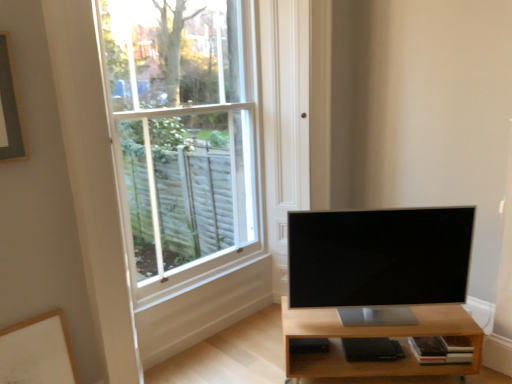
Measure the distance between point (337, 240) and camera.

Point (337, 240) is 7.23 feet away from camera.

The width and height of the screenshot is (512, 384). I want to click on white matte picture frame at lower left, so pyautogui.click(x=37, y=351).

The width and height of the screenshot is (512, 384). Describe the element at coordinates (37, 351) in the screenshot. I see `white matte picture frame at lower left` at that location.

At what (x,y) coordinates should I click in order to perform the action: click on light brown wood shelf at lower right. Please return your answer as a coordinate pair (x, y). Looking at the image, I should click on (375, 336).

Is white glass window at upper left located outside light brown wood shelf at lower right?

Yes, white glass window at upper left is not within light brown wood shelf at lower right.

Between white glass window at upper left and light brown wood shelf at lower right, which one has less height?

With less height is light brown wood shelf at lower right.

Which point is more forward, (189, 48) or (336, 341)?

The point (336, 341) is more forward.

Are light brown wood shelf at lower right and satin black tv at center far apart?

light brown wood shelf at lower right is near satin black tv at center, not far away.

From a real-world perspective, between light brown wood shelf at lower right and satin black tv at center, who is vertically higher?

satin black tv at center.

Can you confirm if light brown wood shelf at lower right is shorter than satin black tv at center?

Yes.

Does light brown wood shelf at lower right have a greater width compared to satin black tv at center?

Indeed, light brown wood shelf at lower right has a greater width compared to satin black tv at center.

Does satin black tv at center have a greater height compared to white glass window at upper left?

No, satin black tv at center is not taller than white glass window at upper left.

Does satin black tv at center turn towards white glass window at upper left?

No, satin black tv at center is not oriented towards white glass window at upper left.

From a real-world perspective, is satin black tv at center above or below white glass window at upper left?

satin black tv at center is below white glass window at upper left.

Identify the location of window located above the satin black tv at center (from the image's perspective). (184, 138).

Is there a large distance between white matte picture frame at lower left and white glass window at upper left?

white matte picture frame at lower left is near white glass window at upper left, not far away.

Which is more distant, (20, 378) or (126, 11)?

Positioned behind is point (126, 11).

Image resolution: width=512 pixels, height=384 pixels. What are the coordinates of `window above the white matte picture frame at lower left (from a real-world perspective)` in the screenshot? It's located at (184, 138).

Are white matte picture frame at lower left and light brown wood shelf at lower right beside each other?

No, white matte picture frame at lower left is not in contact with light brown wood shelf at lower right.

From a real-world perspective, is white matte picture frame at lower left below light brown wood shelf at lower right?

No, from a real-world perspective, white matte picture frame at lower left is not beneath light brown wood shelf at lower right.

In terms of width, does white matte picture frame at lower left look wider or thinner when compared to light brown wood shelf at lower right?

Considering their sizes, white matte picture frame at lower left looks slimmer than light brown wood shelf at lower right.

Is white matte picture frame at lower left shorter than light brown wood shelf at lower right?

No.

Is satin black tv at center aimed at light brown wood shelf at lower right?

No, satin black tv at center does not turn towards light brown wood shelf at lower right.

Who is smaller, satin black tv at center or light brown wood shelf at lower right?

satin black tv at center.

From a real-world perspective, is satin black tv at center above or below light brown wood shelf at lower right?

From a real-world perspective, satin black tv at center is physically above light brown wood shelf at lower right.

Is satin black tv at center not within light brown wood shelf at lower right?

Yes, satin black tv at center is outside of light brown wood shelf at lower right.

Which is in front, white matte picture frame at lower left or satin black tv at center?

white matte picture frame at lower left.

Can you confirm if white matte picture frame at lower left is positioned to the right of satin black tv at center?

No.

Based on the photo, would you say white matte picture frame at lower left is inside or outside satin black tv at center?

white matte picture frame at lower left is located beyond the bounds of satin black tv at center.

Identify the location of window above the light brown wood shelf at lower right (from the image's perspective). This screenshot has height=384, width=512. (184, 138).

Where is `shelf that is below the satin black tv at center (from the image's perspective)`? The image size is (512, 384). shelf that is below the satin black tv at center (from the image's perspective) is located at coordinates (375, 336).

Looking at the image, which one is located closer to white glass window at upper left, satin black tv at center or light brown wood shelf at lower right?

Based on the image, satin black tv at center appears to be nearer to white glass window at upper left.

Based on their spatial positions, is light brown wood shelf at lower right or satin black tv at center closer to white matte picture frame at lower left?

Based on the image, light brown wood shelf at lower right appears to be nearer to white matte picture frame at lower left.

Looking at this image, based on their spatial positions, is white matte picture frame at lower left or light brown wood shelf at lower right further from satin black tv at center?

The object further to satin black tv at center is white matte picture frame at lower left.

Looking at the image, which one is located further to white matte picture frame at lower left, white glass window at upper left or light brown wood shelf at lower right?

The object further to white matte picture frame at lower left is light brown wood shelf at lower right.

Estimate the real-world distances between objects in this image. Which object is further from white matte picture frame at lower left, light brown wood shelf at lower right or white glass window at upper left?

light brown wood shelf at lower right lies further to white matte picture frame at lower left than the other object.

Looking at the image, which one is located further to satin black tv at center, white glass window at upper left or white matte picture frame at lower left?

white matte picture frame at lower left.

Which object lies further to the anchor point light brown wood shelf at lower right, white glass window at upper left or satin black tv at center?

white glass window at upper left is positioned further to the anchor light brown wood shelf at lower right.

From the image, which object appears to be farther from light brown wood shelf at lower right, satin black tv at center or white glass window at upper left?

Based on the image, white glass window at upper left appears to be further to light brown wood shelf at lower right.

Locate an element on the screen. The width and height of the screenshot is (512, 384). television located between white glass window at upper left and light brown wood shelf at lower right in the left-right direction is located at coordinates (379, 261).

Find the location of a particular element. The width and height of the screenshot is (512, 384). window between white matte picture frame at lower left and light brown wood shelf at lower right is located at coordinates (184, 138).

Locate an element on the screen. Image resolution: width=512 pixels, height=384 pixels. window situated between white matte picture frame at lower left and satin black tv at center from left to right is located at coordinates (184, 138).

Image resolution: width=512 pixels, height=384 pixels. What are the coordinates of `television between white matte picture frame at lower left and light brown wood shelf at lower right` in the screenshot? It's located at (379, 261).